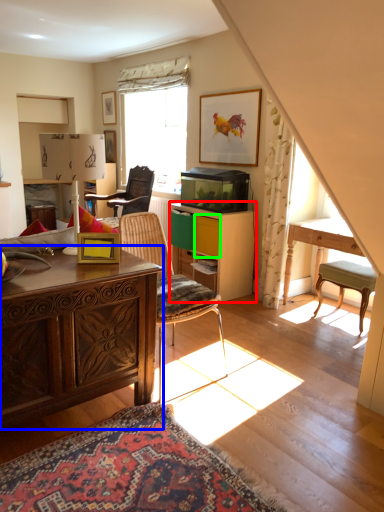
Question: Which is farther away from cabinetry (highlighted by a red box)? desk (highlighted by a blue box) or drawer (highlighted by a green box)?

Choices:
 (A) desk
 (B) drawer

Answer: (A)